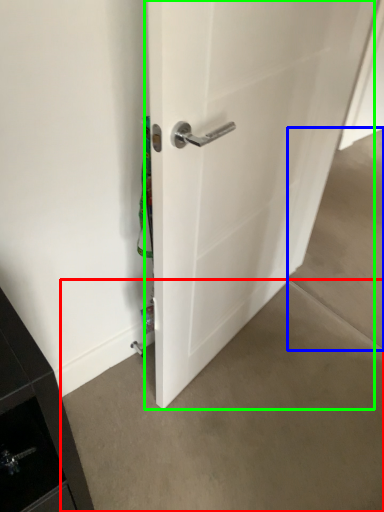
Question: Which object is the closest to the concrete (highlighted by a red box)? Choose among these: concrete (highlighted by a blue box) or door (highlighted by a green box).

Choices:
 (A) concrete
 (B) door

Answer: (B)